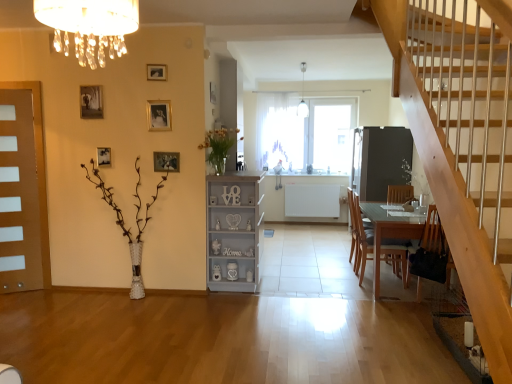
Locate an element on the screen. wooden picture frame at center, which is the sixth picture frame in left-to-right order is located at coordinates (214, 93).

Image resolution: width=512 pixels, height=384 pixels. Describe the element at coordinates (159, 115) in the screenshot. I see `gold metallic picture frame at upper center, the fifth picture frame positioned from the back` at that location.

Where is `dark brown wooden chair at lower right, the second chair from the left`? This screenshot has height=384, width=512. dark brown wooden chair at lower right, the second chair from the left is located at coordinates (430, 253).

At what (x,y) coordinates should I click in order to perform the action: click on transparent glass window at center. Please return your answer as a coordinate pair (x, y). The width and height of the screenshot is (512, 384). Looking at the image, I should click on (306, 132).

The image size is (512, 384). Describe the element at coordinates (103, 156) in the screenshot. I see `matte black picture frame at left, which is the 2th picture frame in back-to-front order` at that location.

Image resolution: width=512 pixels, height=384 pixels. I want to click on matte brown door at left, so click(22, 190).

Which object is positioned more to the right, gold metallic picture frame at upper center, positioned as the fourth picture frame in left-to-right order, or white glass pendant light at upper center?

From the viewer's perspective, white glass pendant light at upper center appears more on the right side.

From the image's perspective, which one is positioned higher, gold metallic picture frame at upper center, the second picture frame when ordered from front to back, or white glass pendant light at upper center?

white glass pendant light at upper center.

Is gold metallic picture frame at upper center, positioned as the fourth picture frame in left-to-right order, oriented away from white glass pendant light at upper center?

That's not correct — gold metallic picture frame at upper center, positioned as the fourth picture frame in left-to-right order, is not looking away from white glass pendant light at upper center.

Considering the relative sizes of gold metallic picture frame at upper center, the fifth picture frame positioned from the back, and white glass pendant light at upper center in the image provided, is gold metallic picture frame at upper center, the fifth picture frame positioned from the back, shorter than white glass pendant light at upper center?

Yes.

Between white textured vase at left, arranged as the 2th plant when viewed from the top, and white painted wood cabinet at center, which one has more height?

white textured vase at left, arranged as the 2th plant when viewed from the top.

From the image's perspective, is white textured vase at left, arranged as the first plant when ordered from the bottom, above white painted wood cabinet at center?

Correct, white textured vase at left, arranged as the first plant when ordered from the bottom, appears higher than white painted wood cabinet at center in the image.

Consider the image. Is white textured vase at left, arranged as the 2th plant when viewed from the top, not inside white painted wood cabinet at center?

Yes, white textured vase at left, arranged as the 2th plant when viewed from the top, is not within white painted wood cabinet at center.

Can you tell me how much white textured vase at left, arranged as the first plant when ordered from the bottom, and white painted wood cabinet at center differ in facing direction?

The facing directions of white textured vase at left, arranged as the first plant when ordered from the bottom, and white painted wood cabinet at center are 90.3 degrees apart.

Could you tell me if matte white crystal chandelier at upper center is facing wooden picture frame at upper left, the sixth picture frame viewed from the right?

No.

How different are the orientations of matte white crystal chandelier at upper center and wooden picture frame at upper left, arranged as the first picture frame when viewed from the left, in degrees?

The angle between the facing direction of matte white crystal chandelier at upper center and the facing direction of wooden picture frame at upper left, arranged as the first picture frame when viewed from the left, is 91.5 degrees.

Is matte white crystal chandelier at upper center not within wooden picture frame at upper left, the sixth picture frame viewed from the right?

Yes, matte white crystal chandelier at upper center is outside of wooden picture frame at upper left, the sixth picture frame viewed from the right.

From the image's perspective, which object appears higher, matte white crystal chandelier at upper center or wooden picture frame at upper left, the sixth picture frame viewed from the right?

wooden picture frame at upper left, the sixth picture frame viewed from the right, is shown above in the image.

Is white textured vase at left, the second plant viewed from the right, positioned with its back to clear glass table at lower right?

No, white textured vase at left, the second plant viewed from the right, is not facing the opposite direction of clear glass table at lower right.

Is white textured vase at left, arranged as the 2th plant when viewed from the top, to the left or to the right of clear glass table at lower right in the image?

In the image, white textured vase at left, arranged as the 2th plant when viewed from the top, appears on the left side of clear glass table at lower right.

Between white textured vase at left, the second plant viewed from the right, and clear glass table at lower right, which one has less height?

clear glass table at lower right.

Does white textured vase at left, the second plant viewed from the right, contain clear glass table at lower right?

No, clear glass table at lower right is not surrounded by white textured vase at left, the second plant viewed from the right.

From the image's perspective, is matte brown door at left positioned above or below wooden picture frame at upper left, which appears as the fourth picture frame when viewed from the back?

matte brown door at left is situated lower than wooden picture frame at upper left, which appears as the fourth picture frame when viewed from the back, in the image.

Based on the photo, measure the distance between matte brown door at left and wooden picture frame at upper left, the sixth picture frame viewed from the right.

matte brown door at left is 36.96 inches from wooden picture frame at upper left, the sixth picture frame viewed from the right.

Is matte brown door at left shorter than wooden picture frame at upper left, the 3th picture frame from the front?

In fact, matte brown door at left may be taller than wooden picture frame at upper left, the 3th picture frame from the front.

Is the surface of matte brown door at left in direct contact with wooden picture frame at upper left, arranged as the first picture frame when viewed from the left?

No.

From a real-world perspective, is wooden chair at lower right, acting as the first chair starting from the back, positioned under translucent glass vase at upper center, placed as the second plant when sorted from bottom to top, based on gravity?

Correct, in the physical world, wooden chair at lower right, acting as the first chair starting from the back, is lower than translucent glass vase at upper center, placed as the second plant when sorted from bottom to top.

Is wooden chair at lower right, which appears as the first chair when viewed from the left, positioned beyond the bounds of translucent glass vase at upper center, which is the 1th plant in top-to-bottom order?

Yes, wooden chair at lower right, which appears as the first chair when viewed from the left, is located beyond the bounds of translucent glass vase at upper center, which is the 1th plant in top-to-bottom order.

What's the angular difference between wooden chair at lower right, the 2th chair from the front, and translucent glass vase at upper center, which is the 2th plant in left-to-right order,'s facing directions?

They differ by 0.117 degrees in their facing directions.

Which is more to the left, translucent glass vase at upper center, which is the 2th plant in left-to-right order, or matte black picture frame at left, the fifth picture frame viewed from the right?

Positioned to the left is matte black picture frame at left, the fifth picture frame viewed from the right.

Relative to matte black picture frame at left, the fifth picture frame viewed from the right, is translucent glass vase at upper center, which is the 1th plant in top-to-bottom order, in front or behind?

In the image, translucent glass vase at upper center, which is the 1th plant in top-to-bottom order, appears in front of matte black picture frame at left, the fifth picture frame viewed from the right.

This screenshot has height=384, width=512. In order to click on plant positioned vertically above the matte black picture frame at left, which is the 2th picture frame in back-to-front order (from a real-world perspective) in this screenshot , I will do `click(219, 146)`.

Where is `light fixture lying on the right of gold metallic picture frame at upper center, the second picture frame when ordered from front to back`? light fixture lying on the right of gold metallic picture frame at upper center, the second picture frame when ordered from front to back is located at coordinates (303, 96).

Find the location of a particular element. cabinetry that appears below the white textured vase at left, arranged as the 2th plant when viewed from the top (from a real-world perspective) is located at coordinates (234, 231).

Which object lies further to the anchor point white painted wood cabinet at center, dark brown wooden chair at lower right, the second chair viewed from the back, or wooden picture frame at upper left, the sixth picture frame viewed from the right?

dark brown wooden chair at lower right, the second chair viewed from the back, is positioned further to the anchor white painted wood cabinet at center.

Looking at the image, which one is located closer to wooden picture frame at upper center, acting as the 3th picture frame starting from the left, clear glass table at lower right or matte white crystal chandelier at upper center?

The object closer to wooden picture frame at upper center, acting as the 3th picture frame starting from the left, is matte white crystal chandelier at upper center.

Based on their spatial positions, is wooden picture frame at center, which is the sixth picture frame in left-to-right order, or translucent glass vase at upper center, which is the 1th plant in top-to-bottom order, further from clear glass table at lower right?

Among the two, wooden picture frame at center, which is the sixth picture frame in left-to-right order, is located further to clear glass table at lower right.

Based on their spatial positions, is matte white crystal chandelier at upper center or translucent glass vase at upper center, placed as the second plant when sorted from bottom to top, further from dark brown wooden chair at lower right, the second chair viewed from the back?

Based on the image, matte white crystal chandelier at upper center appears to be further to dark brown wooden chair at lower right, the second chair viewed from the back.

Which object lies further to the anchor point gold metallic picture frame at upper center, the fifth picture frame positioned from the back, dark brown wooden chair at lower right, the 1th chair in the front-to-back sequence, or wooden chair at lower right, the 2th chair from the front?

dark brown wooden chair at lower right, the 1th chair in the front-to-back sequence, is positioned further to the anchor gold metallic picture frame at upper center, the fifth picture frame positioned from the back.

Based on their spatial positions, is wooden picture frame at upper center, acting as the 3th picture frame starting from the left, or white textured vase at left, the second plant viewed from the right, closer to matte black picture frame at left, which is the 2th picture frame in back-to-front order?

white textured vase at left, the second plant viewed from the right, is positioned closer to the anchor matte black picture frame at left, which is the 2th picture frame in back-to-front order.

Estimate the real-world distances between objects in this image. Which object is further from white textured vase at left, which ranks as the first plant in left-to-right order, translucent glass vase at upper center, which is the 2th plant in left-to-right order, or transparent glass window at center?

transparent glass window at center.

Based on their spatial positions, is wooden picture frame at upper left, the 3th picture frame from the front, or transparent glass window at center closer to wooden chair at lower right, placed as the 2th chair when sorted from right to left?

wooden picture frame at upper left, the 3th picture frame from the front.

Find the location of a particular element. cabinetry between wooden picture frame at center, the first picture frame viewed from the right, and clear glass table at lower right is located at coordinates (234, 231).

Identify the location of door between wooden picture frame at upper center, acting as the 3th picture frame starting from the left, and white textured vase at left, arranged as the 2th plant when viewed from the top, vertically. This screenshot has width=512, height=384. (22, 190).

Where is `table between matte brown door at left and dark brown wooden chair at lower right, the 1th chair in the front-to-back sequence`? table between matte brown door at left and dark brown wooden chair at lower right, the 1th chair in the front-to-back sequence is located at coordinates (390, 231).

Locate an element on the screen. cabinetry between translucent glass vase at upper center, which is the 1th plant in top-to-bottom order, and dark brown wooden chair at lower right, the 1th chair in the front-to-back sequence, from left to right is located at coordinates (234, 231).